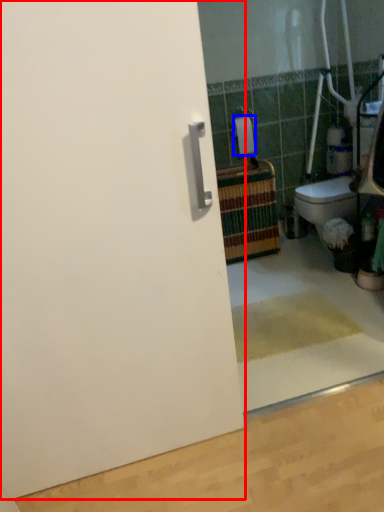
Question: Which object appears closest to the camera in this image, door (highlighted by a red box) or toilet paper (highlighted by a blue box)?

Choices:
 (A) door
 (B) toilet paper

Answer: (A)